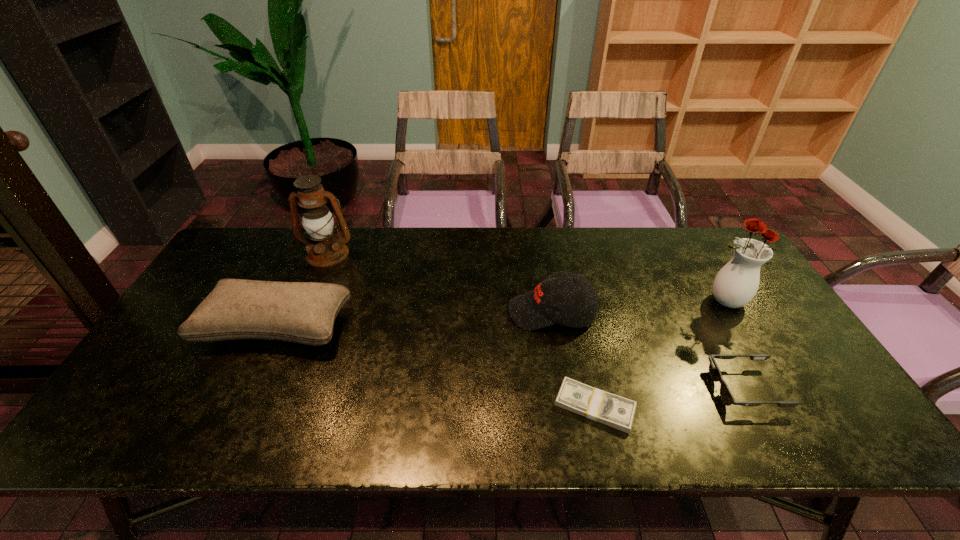
Locate an element on the screen. The height and width of the screenshot is (540, 960). vacant space that's between the shortest object and the vase is located at coordinates (660, 353).

The image size is (960, 540). Find the location of `free space between the sunglasses and the cushion`. free space between the sunglasses and the cushion is located at coordinates (511, 357).

At what (x,y) coordinates should I click in order to perform the action: click on blank region between the vase and the baseball cap. Please return your answer as a coordinate pair (x, y). This screenshot has width=960, height=540. Looking at the image, I should click on (637, 307).

Find the location of a particular element. Image resolution: width=960 pixels, height=540 pixels. empty space that is in between the baseball cap and the shortest object is located at coordinates (573, 360).

Locate an element on the screen. free area in between the baseball cap and the cushion is located at coordinates [414, 320].

Find the location of a particular element. object that is the third closest to the baseball cap is located at coordinates (736, 284).

Image resolution: width=960 pixels, height=540 pixels. Identify the location of the fifth closest object to the lantern. (736, 284).

Locate an element on the screen. The image size is (960, 540). vacant region that satisfies the following two spatial constraints: 1. on the front side of the vase; 2. on the front-facing side of the baseball cap is located at coordinates (731, 313).

Find the location of `blank area in the image that satisfies the following two spatial constraints: 1. on the back side of the cushion; 2. on the right side of the vase`. blank area in the image that satisfies the following two spatial constraints: 1. on the back side of the cushion; 2. on the right side of the vase is located at coordinates (289, 301).

At what (x,y) coordinates should I click in order to perform the action: click on vacant space that satisfies the following two spatial constraints: 1. on the side of the lantern, there is a wick adjustment knob; 2. on the left side of the dollar. Please return your answer as a coordinate pair (x, y). Image resolution: width=960 pixels, height=540 pixels. Looking at the image, I should click on (263, 406).